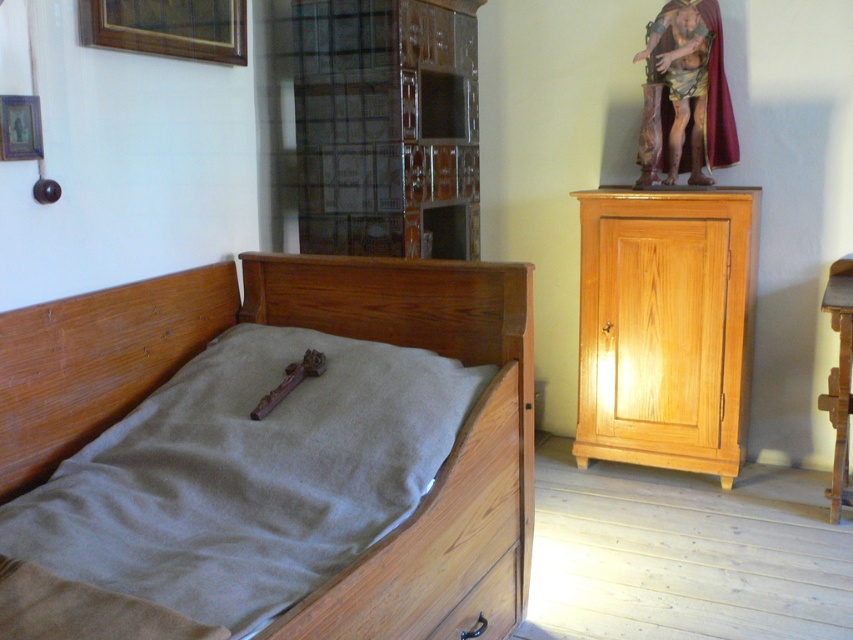
Does point (141, 330) lie in front of point (498, 588)?

Yes, point (141, 330) is in front of point (498, 588).

Does point (329, 637) lie behind point (456, 614)?

No, (329, 637) is closer to viewer.

Between point (508, 531) and point (491, 589), which one is positioned in front?

Point (491, 589) is more forward.

This screenshot has width=853, height=640. What are the coordinates of `wooden bed at left` in the screenshot? It's located at (318, 330).

Image resolution: width=853 pixels, height=640 pixels. Identify the location of wooden bed at left. (318, 330).

Does point (395, 301) lie in front of point (733, 230)?

Yes.

Locate an element on the screen. wooden bed at left is located at coordinates coord(318,330).

Looking at this image, can you confirm if light brown wood cabinet at right is bigger than wooden crucifix at center?

Yes.

Does light brown wood cabinet at right have a smaller size compared to wooden crucifix at center?

No, light brown wood cabinet at right is not smaller than wooden crucifix at center.

Identify the location of light brown wood cabinet at right. (666, 326).

This screenshot has width=853, height=640. I want to click on light brown wood cabinet at right, so click(x=666, y=326).